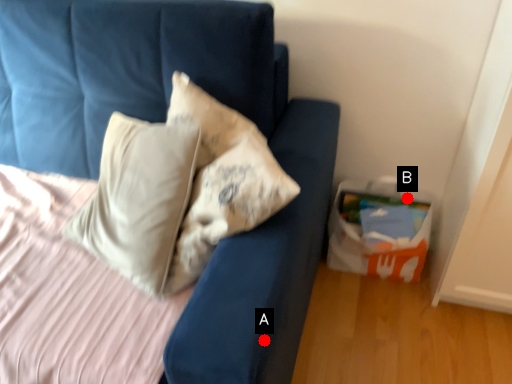
Question: Two points are circled on the image, labeled by A and B beside each circle. Which point is further to the camera?

Choices:
 (A) A is further
 (B) B is further

Answer: (B)